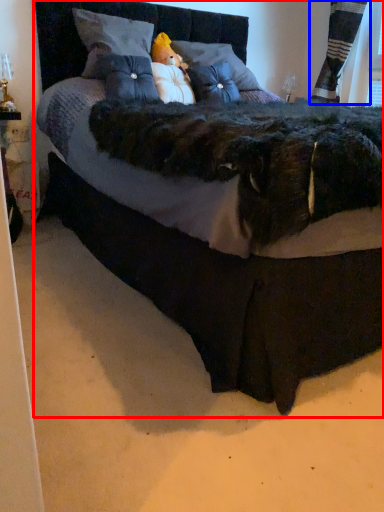
Question: Which object appears farthest to the camera in this image, bed (highlighted by a red box) or curtain (highlighted by a blue box)?

Choices:
 (A) bed
 (B) curtain

Answer: (B)